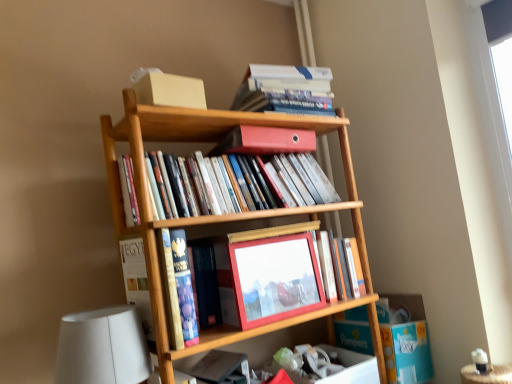
Question: From the image's perspective, would you say matte plastic binder at center, the third book when ordered from top to bottom, is shown under hardcover book at upper center, which appears as the 1th book when viewed from the top?

Choices:
 (A) yes
 (B) no

Answer: (A)

Question: Considering the relative positions of matte plastic binder at center, the third book when ordered from top to bottom, and hardcover book at upper center, which is counted as the 6th book, starting from the bottom, in the image provided, is matte plastic binder at center, the third book when ordered from top to bottom, behind hardcover book at upper center, which is counted as the 6th book, starting from the bottom,?

Choices:
 (A) no
 (B) yes

Answer: (A)

Question: Can you confirm if matte plastic binder at center, which appears as the fourth book when ordered from the bottom, is bigger than hardcover book at upper center, which appears as the 1th book when viewed from the top?

Choices:
 (A) yes
 (B) no

Answer: (A)

Question: Is matte plastic binder at center, the third book when ordered from top to bottom, wider than hardcover book at upper center, which appears as the 1th book when viewed from the top?

Choices:
 (A) yes
 (B) no

Answer: (B)

Question: Can you confirm if matte plastic binder at center, the third book when ordered from top to bottom, is shorter than hardcover book at upper center, which appears as the 1th book when viewed from the top?

Choices:
 (A) yes
 (B) no

Answer: (B)

Question: Is point (350, 254) closer or farther from the camera than point (167, 249)?

Choices:
 (A) closer
 (B) farther

Answer: (B)

Question: Is matte wooden frame at center, placed as the third book when sorted from bottom to top, bigger or smaller than hardcover book at center, placed as the fifth book when sorted from top to bottom?

Choices:
 (A) big
 (B) small

Answer: (B)

Question: From their relative heights in the image, would you say matte wooden frame at center, placed as the third book when sorted from bottom to top, is taller or shorter than hardcover book at center, placed as the fifth book when sorted from top to bottom?

Choices:
 (A) short
 (B) tall

Answer: (A)

Question: From the image's perspective, relative to hardcover book at center, acting as the second book starting from the bottom, is matte wooden frame at center, placed as the third book when sorted from bottom to top, above or below?

Choices:
 (A) above
 (B) below

Answer: (A)

Question: Looking at their shapes, would you say white matte table lamp at lower left is wider or thinner than hardcover book at center, placed as the fifth book when sorted from top to bottom?

Choices:
 (A) wide
 (B) thin

Answer: (A)

Question: From the image's perspective, is white matte table lamp at lower left positioned above or below hardcover book at center, acting as the second book starting from the bottom?

Choices:
 (A) above
 (B) below

Answer: (B)

Question: From a real-world perspective, is white matte table lamp at lower left physically located above or below hardcover book at center, placed as the fifth book when sorted from top to bottom?

Choices:
 (A) below
 (B) above

Answer: (A)

Question: In terms of height, does white matte table lamp at lower left look taller or shorter compared to hardcover book at center, placed as the fifth book when sorted from top to bottom?

Choices:
 (A) tall
 (B) short

Answer: (B)

Question: Would you say hardcover book at upper center, which is counted as the 6th book, starting from the bottom, is to the left or to the right of matte wooden frame at center, placed as the third book when sorted from bottom to top, in the picture?

Choices:
 (A) right
 (B) left

Answer: (B)

Question: In terms of width, does hardcover book at upper center, which appears as the 1th book when viewed from the top, look wider or thinner when compared to matte wooden frame at center, placed as the third book when sorted from bottom to top?

Choices:
 (A) thin
 (B) wide

Answer: (B)